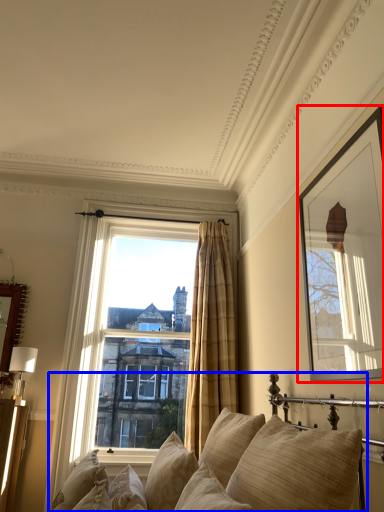
Question: Which of the following is the closest to the observer, picture frame (highlighted by a red box) or studio couch (highlighted by a blue box)?

Choices:
 (A) picture frame
 (B) studio couch

Answer: (B)